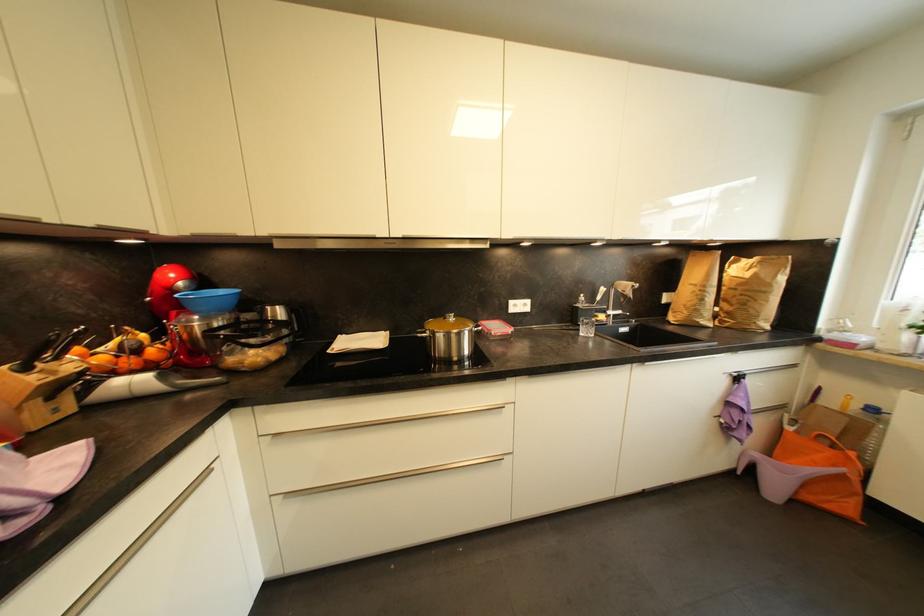
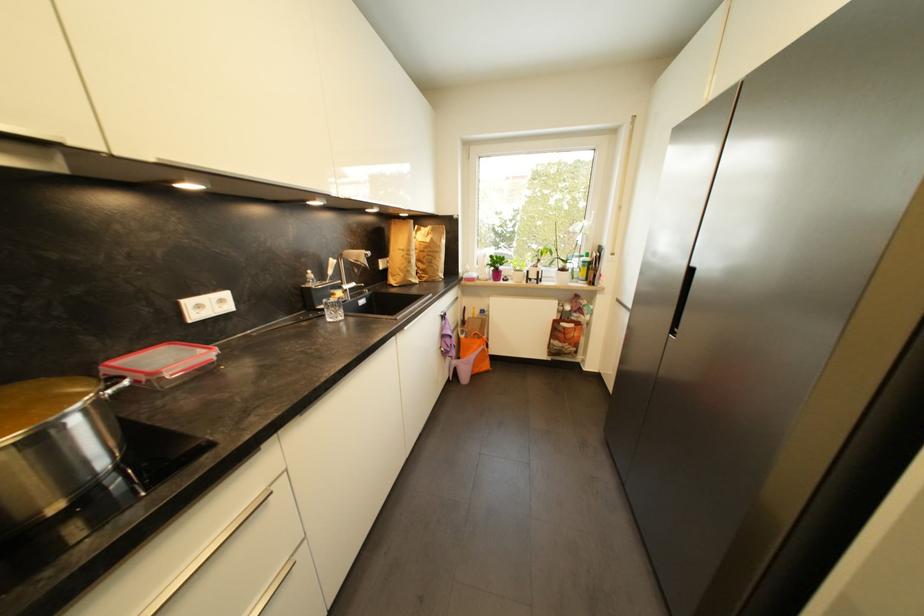
Find the pixel in the second image that matches point (744, 286) in the first image.

(430, 249)